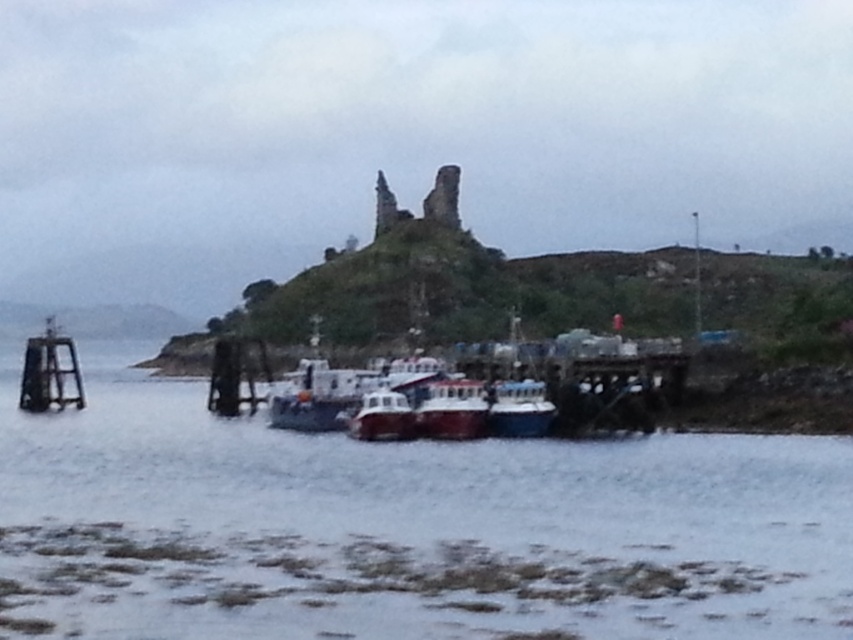
You are a dock worker who needs to secure both the blue glossy boat at center and the white glossy boat at center. Since you can only move along the pier, which boat should you secure first if you start from the left end of the pier?

The white glossy boat at center should be secured first because it is positioned to the left of the blue glossy boat at center, meaning it is closer to the starting point at the left end of the pier.

You are a dock worker who needs to move a cargo container that requires 10 square meters of space. You see the white matte boat at center and the red glossy boat at center. Which boat has enough space to accommodate the cargo container based on their sizes?

The white matte boat at center has a larger size compared to the red glossy boat at center, so it can accommodate the cargo container requiring 10 square meters of space.

You are a delivery person with a cart that is 4 meters wide. You need to move between the white matte boat at center and the red glossy boat at center. Can your cart fit through the space between them?

The white matte boat at center and red glossy boat at center are 3.89 meters apart. Since the cart is 4 meters wide, it cannot fit through the space between them.